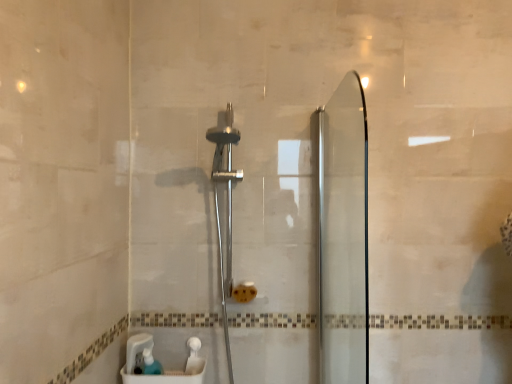
What is the approximate width of polished chrome shower head at center?

28.21 centimeters.

What do you see at coordinates (160, 364) in the screenshot? I see `translucent plastic container at lower center` at bounding box center [160, 364].

Where is `translucent plastic soap dispenser at lower left`? translucent plastic soap dispenser at lower left is located at coordinates (150, 363).

From a real-world perspective, is transparent glass screen door at right on polished chrome shower head at center?

Yes, from a real-world perspective, transparent glass screen door at right is over polished chrome shower head at center

Does transparent glass screen door at right come behind polished chrome shower head at center?

No, transparent glass screen door at right is closer to the viewer.

Is transparent glass screen door at right shorter than polished chrome shower head at center?

Yes.

Which of these two, polished chrome shower head at center or translucent plastic container at lower center, is smaller?

translucent plastic container at lower center.

Based on the photo, from a real-world perspective, is polished chrome shower head at center located beneath translucent plastic container at lower center?

No, from a real-world perspective, polished chrome shower head at center is not below translucent plastic container at lower center.

Considering the relative sizes of polished chrome shower head at center and translucent plastic container at lower center in the image provided, is polished chrome shower head at center thinner than translucent plastic container at lower center?

In fact, polished chrome shower head at center might be wider than translucent plastic container at lower center.

Is polished chrome shower head at center completely or partially inside translucent plastic soap dispenser at lower left?

No, polished chrome shower head at center is located outside of translucent plastic soap dispenser at lower left.

From the picture: Considering the sizes of objects translucent plastic soap dispenser at lower left and polished chrome shower head at center in the image provided, who is taller, translucent plastic soap dispenser at lower left or polished chrome shower head at center?

polished chrome shower head at center is taller.

You are a GUI agent. You are given a task and a screenshot of the screen. Output one action in this format:
    pyautogui.click(x=<x>, y=<y>)
    Task: Click on the toiletry that appears below the polished chrome shower head at center (from the image's perspective)
    The height and width of the screenshot is (384, 512).
    Given the screenshot: What is the action you would take?
    pyautogui.click(x=150, y=363)

Considering the positions of objects translucent plastic soap dispenser at lower left and polished chrome shower head at center in the image provided, who is in front, translucent plastic soap dispenser at lower left or polished chrome shower head at center?

polished chrome shower head at center is in front.

Based on the photo, from a real-world perspective, who is located higher, transparent glass screen door at right or translucent plastic soap dispenser at lower left?

From a 3D spatial view, transparent glass screen door at right is above.

Can you confirm if transparent glass screen door at right is positioned to the right of translucent plastic soap dispenser at lower left?

Indeed, transparent glass screen door at right is positioned on the right side of translucent plastic soap dispenser at lower left.

From the image's perspective, is transparent glass screen door at right below translucent plastic soap dispenser at lower left?

Incorrect, from the image's perspective, transparent glass screen door at right is higher than translucent plastic soap dispenser at lower left.

Does translucent plastic soap dispenser at lower left have a smaller size compared to translucent plastic container at lower center?

Correct, translucent plastic soap dispenser at lower left occupies less space than translucent plastic container at lower center.

Considering the positions of objects translucent plastic soap dispenser at lower left and translucent plastic container at lower center in the image provided, who is behind, translucent plastic soap dispenser at lower left or translucent plastic container at lower center?

translucent plastic container at lower center is more distant.

Based on the photo, is translucent plastic soap dispenser at lower left facing towards translucent plastic container at lower center?

Yes, translucent plastic soap dispenser at lower left is oriented towards translucent plastic container at lower center.

In the scene shown: Would you say translucent plastic container at lower center is a long distance from polished chrome shower head at center?

No, there isn't a large distance between translucent plastic container at lower center and polished chrome shower head at center.

From a real-world perspective, is translucent plastic container at lower center on top of polished chrome shower head at center?

Incorrect, from a real-world perspective, translucent plastic container at lower center is lower than polished chrome shower head at center.

Is translucent plastic container at lower center facing away from polished chrome shower head at center?

No, translucent plastic container at lower center is not facing away from polished chrome shower head at center.

From a real-world perspective, is translucent plastic container at lower center physically located above or below transparent glass screen door at right?

translucent plastic container at lower center is below transparent glass screen door at right.

Is translucent plastic container at lower center in front of transparent glass screen door at right?

No.

Is point (131, 374) positioned in front of point (339, 283)?

No, it is not.

Is translucent plastic container at lower center spatially inside transparent glass screen door at right, or outside of it?

The correct answer is: outside.

Image resolution: width=512 pixels, height=384 pixels. I want to click on shower below the transparent glass screen door at right (from the image's perspective), so click(227, 209).

Where is `sink behind the polished chrome shower head at center`? sink behind the polished chrome shower head at center is located at coordinates (160, 364).

Looking at the image, which one is located further to translucent plastic container at lower center, polished chrome shower head at center or transparent glass screen door at right?

Based on the image, transparent glass screen door at right appears to be further to translucent plastic container at lower center.

When comparing their distances from translucent plastic container at lower center, does translucent plastic soap dispenser at lower left or transparent glass screen door at right seem further?

Among the two, transparent glass screen door at right is located further to translucent plastic container at lower center.

Which object lies nearer to the anchor point polished chrome shower head at center, translucent plastic soap dispenser at lower left or translucent plastic container at lower center?

Among the two, translucent plastic container at lower center is located nearer to polished chrome shower head at center.

Consider the image. Considering their positions, is translucent plastic container at lower center positioned further to polished chrome shower head at center than translucent plastic soap dispenser at lower left?

The object further to polished chrome shower head at center is translucent plastic soap dispenser at lower left.

Looking at this image, estimate the real-world distances between objects in this image. Which object is further from polished chrome shower head at center, translucent plastic soap dispenser at lower left or transparent glass screen door at right?

translucent plastic soap dispenser at lower left.

Based on their spatial positions, is transparent glass screen door at right or polished chrome shower head at center further from translucent plastic container at lower center?

The object further to translucent plastic container at lower center is transparent glass screen door at right.

From the image, which object appears to be farther from translucent plastic container at lower center, polished chrome shower head at center or translucent plastic soap dispenser at lower left?

polished chrome shower head at center is positioned further to the anchor translucent plastic container at lower center.

Considering their positions, is polished chrome shower head at center positioned closer to translucent plastic soap dispenser at lower left than transparent glass screen door at right?

Based on the image, polished chrome shower head at center appears to be nearer to translucent plastic soap dispenser at lower left.

Where is `shower located between transparent glass screen door at right and translucent plastic container at lower center in the depth direction`? shower located between transparent glass screen door at right and translucent plastic container at lower center in the depth direction is located at coordinates (227, 209).

Identify the location of shower positioned between transparent glass screen door at right and translucent plastic soap dispenser at lower left from near to far. (227, 209).

The width and height of the screenshot is (512, 384). In order to click on sink situated between translucent plastic soap dispenser at lower left and transparent glass screen door at right from left to right in this screenshot , I will do click(x=160, y=364).

Image resolution: width=512 pixels, height=384 pixels. What are the coordinates of `toiletry between polished chrome shower head at center and translucent plastic container at lower center in the up-down direction` in the screenshot? It's located at (150, 363).